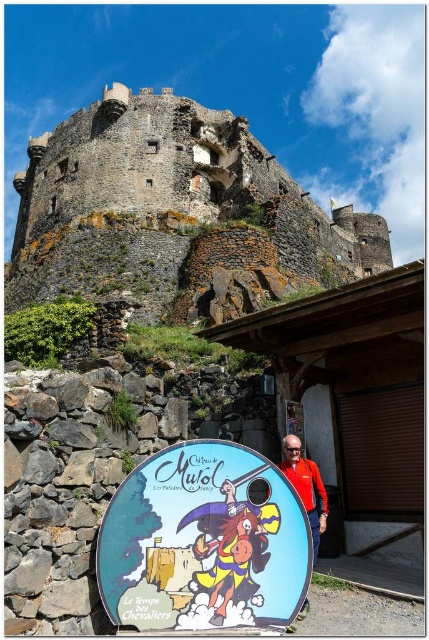
You are a tourist standing at the base of the hill looking up at the castle. You notice an orange fabric jacket at center and a rusty stone castle at upper center. Which object is closer to you?

The rusty stone castle at upper center is closer to you because the orange fabric jacket at center is behind it.

You are standing at the base of the historic stone castle and want to take a photo of the point at coordinate (65, 253). If your camera has a maximum range of 250 feet, will you be able to capture the point in your photo?

The point at coordinate (65, 253) is 247.66 feet away from the camera. Since this distance is within the camera maximum range of 250 feet, the camera can capture the point in the photo.

You are a tourist standing at the base of the historic stone castle. You notice a point marked at coordinates (204,541). According to the scene description, which object is this point located on?

The point is located on the matte plastic shield at center.